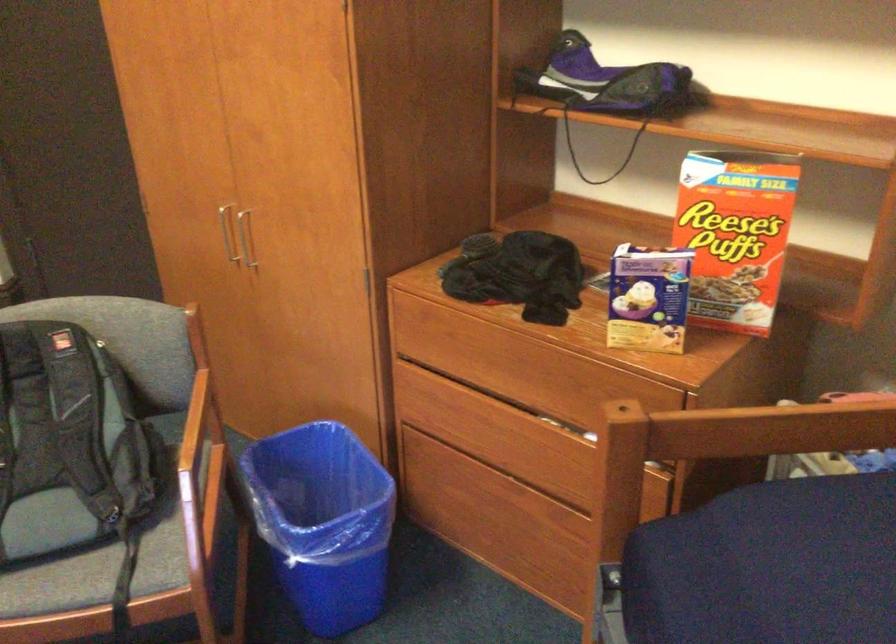
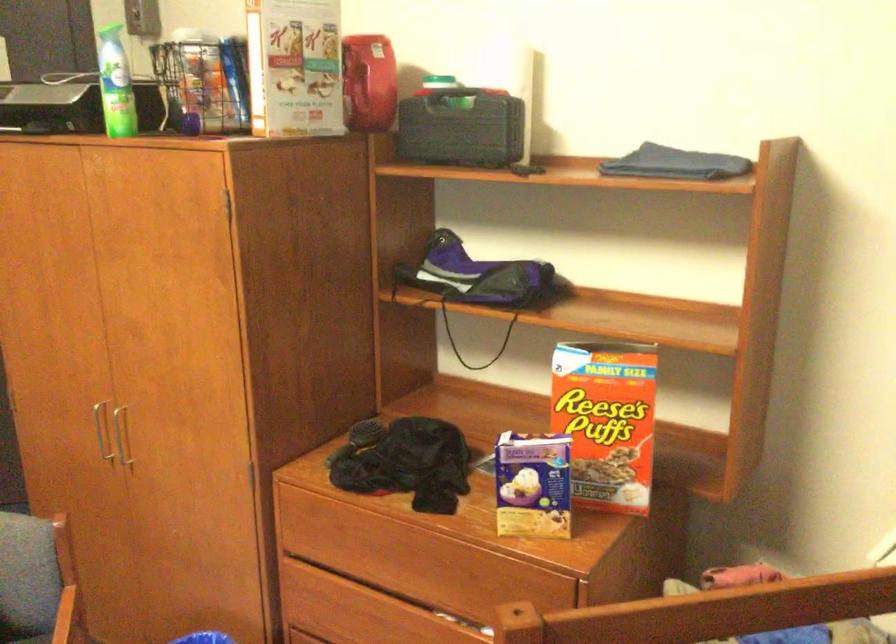
Where in the second image is the point corresponding to (x=245, y=240) from the first image?

(119, 436)